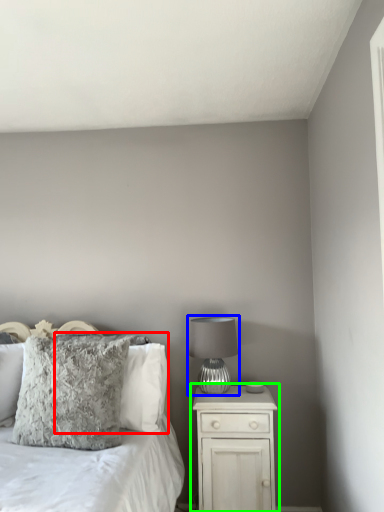
Question: Estimate the real-world distances between objects in this image. Which object is closer to pillow (highlighted by a red box), table lamp (highlighted by a blue box) or nightstand (highlighted by a green box)?

Choices:
 (A) table lamp
 (B) nightstand

Answer: (A)